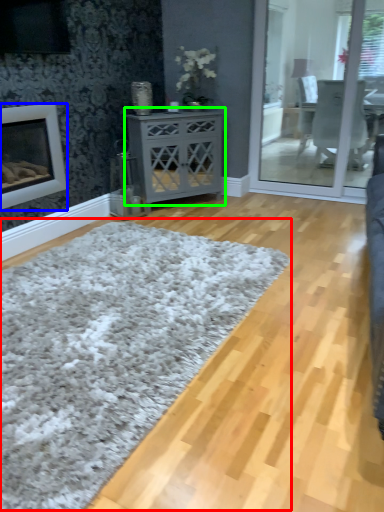
Question: Based on their relative distances, which object is farther from plain (highlighted by a red box)? Choose from fireplace (highlighted by a blue box) and nightstand (highlighted by a green box).

Choices:
 (A) fireplace
 (B) nightstand

Answer: (B)